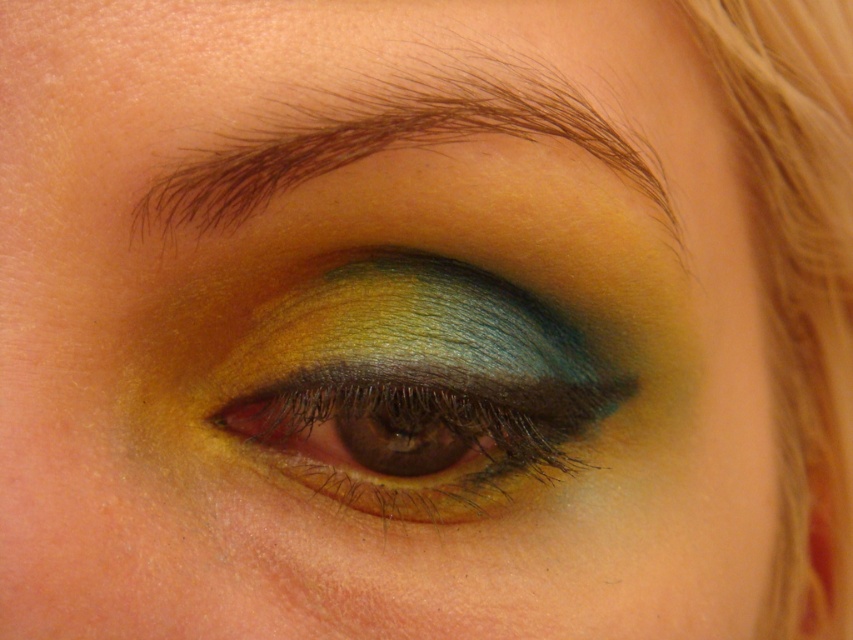
Can you confirm if metallic shimmering eye at center is thinner than brownhair-likeeyebrow at upper center?

Indeed, metallic shimmering eye at center has a lesser width compared to brownhair-likeeyebrow at upper center.

Does point (367, 413) lie behind point (577, 104)?

Yes, it is behind point (577, 104).

Measure the distance between metallic shimmering eye at center and camera.

metallic shimmering eye at center is 12.24 inches from camera.

Identify the location of metallic shimmering eye at center. This screenshot has width=853, height=640. (415, 388).